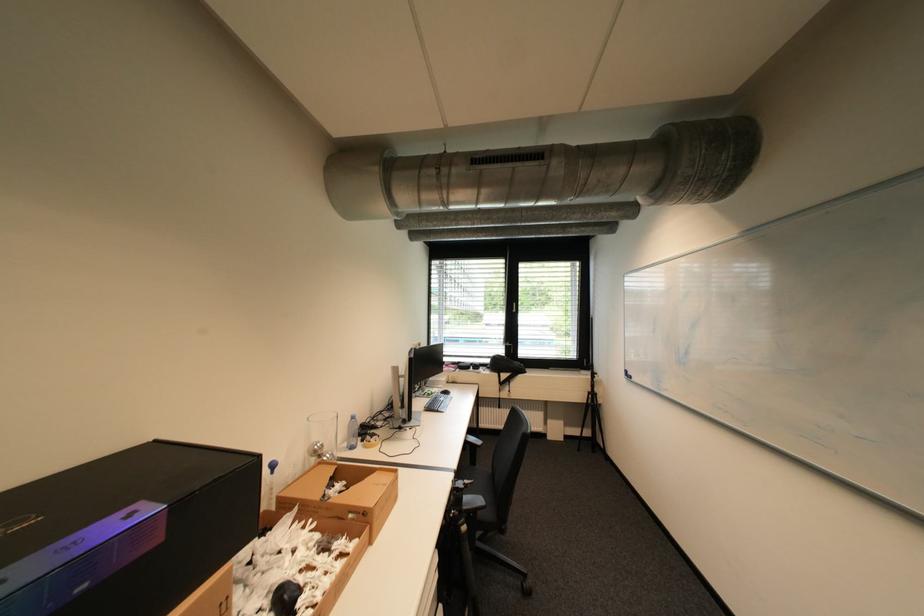
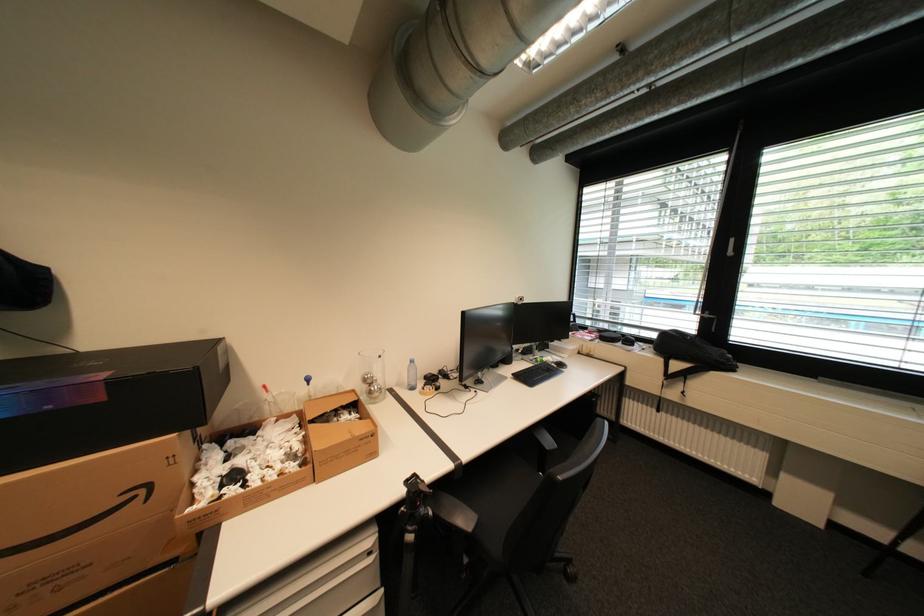
Question: The images are taken continuously from a first-person perspective. In which direction is your viewpoint rotating?

Choices:
 (A) Left
 (B) Right
 (C) Up
 (D) Down

Answer: (A)